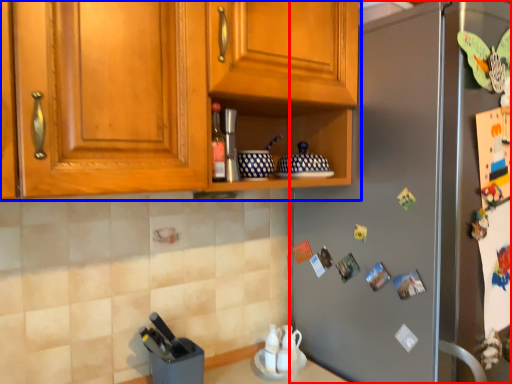
Question: Which object is further to the camera taking this photo, refrigerator (highlighted by a red box) or cabinetry (highlighted by a blue box)?

Choices:
 (A) refrigerator
 (B) cabinetry

Answer: (A)